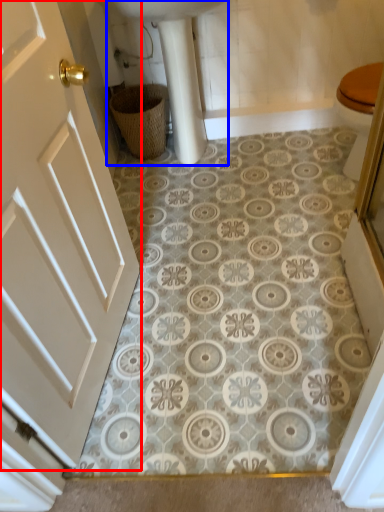
Question: Among these objects, which one is farthest to the camera, door (highlighted by a red box) or sink (highlighted by a blue box)?

Choices:
 (A) door
 (B) sink

Answer: (B)